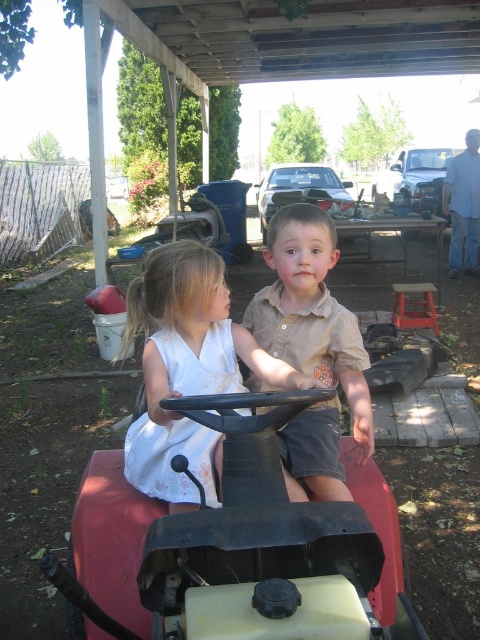
Where is `white matte dress at center`? The width and height of the screenshot is (480, 640). white matte dress at center is located at coordinates (188, 369).

Does white matte dress at center have a lesser height compared to metallic silver truck at upper right?

Correct, white matte dress at center is not as tall as metallic silver truck at upper right.

Image resolution: width=480 pixels, height=640 pixels. I want to click on white matte dress at center, so click(x=188, y=369).

Does brown cotton shirt at center have a greater width compared to metallic silver toy car at center?

No, brown cotton shirt at center is not wider than metallic silver toy car at center.

Between brown cotton shirt at center and metallic silver toy car at center, which one has less height?

With less height is brown cotton shirt at center.

Is point (327, 321) positioned in front of point (351, 205)?

Yes.

This screenshot has width=480, height=640. I want to click on brown cotton shirt at center, so click(311, 312).

Consider the image. Who is positioned more to the left, matte plastic toy car at center or metallic silver truck at upper right?

From the viewer's perspective, matte plastic toy car at center appears more on the left side.

Who is shorter, matte plastic toy car at center or metallic silver truck at upper right?

matte plastic toy car at center

Is point (266, 593) more distant than point (423, 164)?

No, (266, 593) is closer to viewer.

The width and height of the screenshot is (480, 640). I want to click on matte plastic toy car at center, so [x=230, y=538].